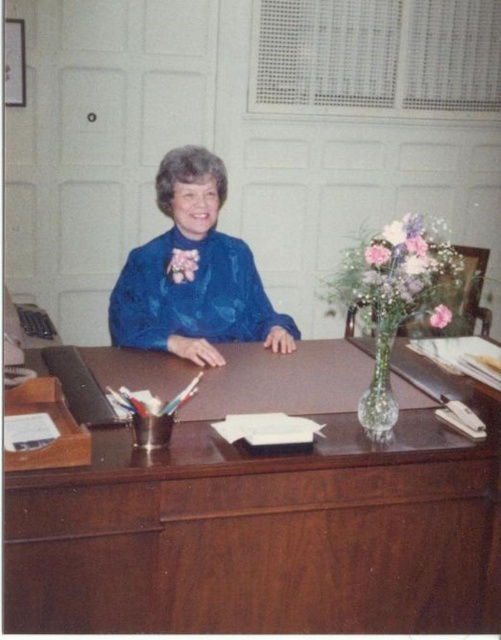
Between brown wood table at center and blue satin blouse at center, which one appears on the right side from the viewer's perspective?

Positioned to the right is brown wood table at center.

Does brown wood table at center lie in front of blue satin blouse at center?

Yes, it is in front of blue satin blouse at center.

Between point (242, 532) and point (254, 336), which one is positioned in front?

Point (242, 532) is more forward.

The width and height of the screenshot is (501, 640). I want to click on brown wood table at center, so click(x=262, y=534).

Is pink silk flower at center below pink matte flower at center?

No.

Which is above, pink silk flower at center or pink matte flower at center?

pink silk flower at center

Which is behind, point (173, 280) or point (449, 314)?

Positioned behind is point (173, 280).

This screenshot has width=501, height=640. Find the location of `pink silk flower at center`. pink silk flower at center is located at coordinates (182, 264).

Is blue satin blouse at center thinner than translucent glass vase at center?

In fact, blue satin blouse at center might be wider than translucent glass vase at center.

Is blue satin blouse at center below translucent glass vase at center?

Incorrect, blue satin blouse at center is not positioned below translucent glass vase at center.

Is point (214, 340) less distant than point (379, 244)?

No, (214, 340) is behind (379, 244).

Where is `blue satin blouse at center`? Image resolution: width=501 pixels, height=640 pixels. blue satin blouse at center is located at coordinates (194, 275).